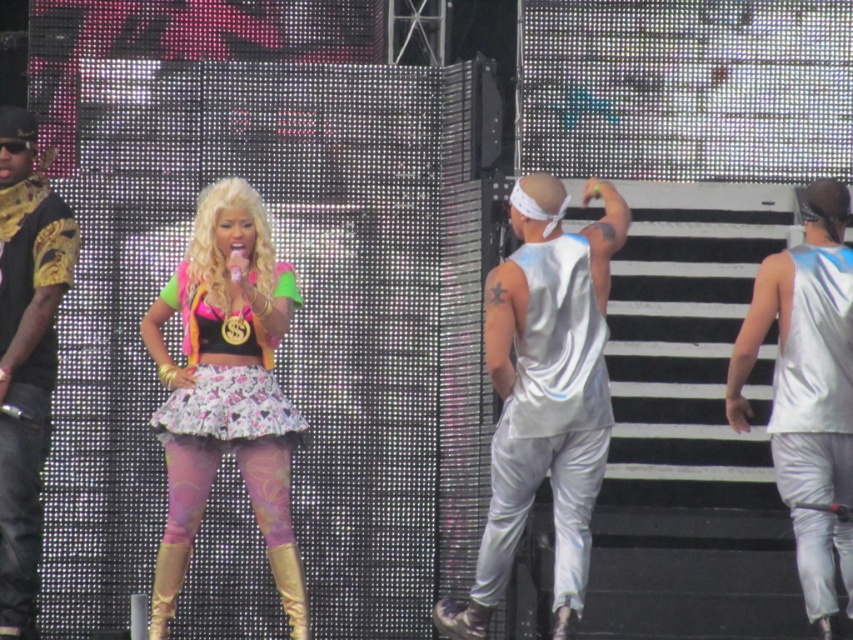
Can you confirm if silver metallic tank top at right is shorter than matte pink skirt at center?

In fact, silver metallic tank top at right may be taller than matte pink skirt at center.

Who is more forward, (613, 244) or (256, 236)?

Point (613, 244)

At what (x,y) coordinates should I click in order to perform the action: click on silver metallic tank top at right. Please return your answer as a coordinate pair (x, y). The width and height of the screenshot is (853, 640). Looking at the image, I should click on (544, 394).

Is matte pink skirt at center smaller than shiny metallic skirt at center?

Indeed, matte pink skirt at center has a smaller size compared to shiny metallic skirt at center.

Which is in front, point (189, 452) or point (287, 296)?

Point (189, 452) is in front.

Where is `matte pink skirt at center`? matte pink skirt at center is located at coordinates (225, 390).

Does point (201, 371) come in front of point (47, 445)?

Yes, point (201, 371) is closer to viewer.

Is the position of matte pink skirt at center more distant than that of gold-patterned shirt at left?

No, matte pink skirt at center is in front of gold-patterned shirt at left.

What are the coordinates of `matte pink skirt at center` in the screenshot? It's located at (225, 390).